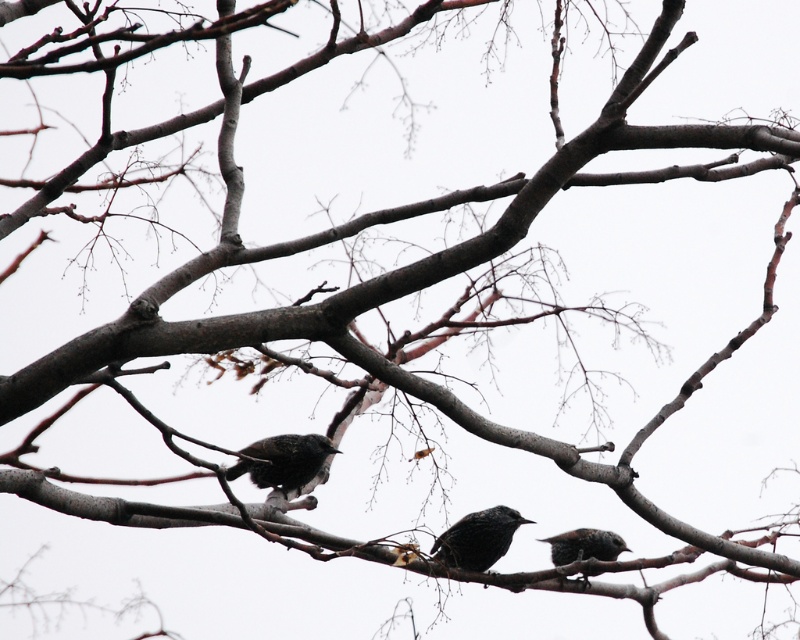
Question: Which point appears closest to the camera in this image?

Choices:
 (A) (500, 550)
 (B) (605, 554)
 (C) (282, 458)

Answer: (A)

Question: Which point is farther to the camera?

Choices:
 (A) (600, 532)
 (B) (292, 474)

Answer: (B)

Question: Is dark brown speckled bird at center smaller than dark gray feathers at center?

Choices:
 (A) no
 (B) yes

Answer: (A)

Question: Can you confirm if dark brown speckled bird at center is wider than dark gray speckled bird at lower right?

Choices:
 (A) yes
 (B) no

Answer: (A)

Question: Which of the following is the closest to the observer?

Choices:
 (A) (488, 536)
 (B) (236, 472)

Answer: (A)

Question: Is dark brown speckled bird at center below dark gray speckled bird at lower right?

Choices:
 (A) no
 (B) yes

Answer: (A)